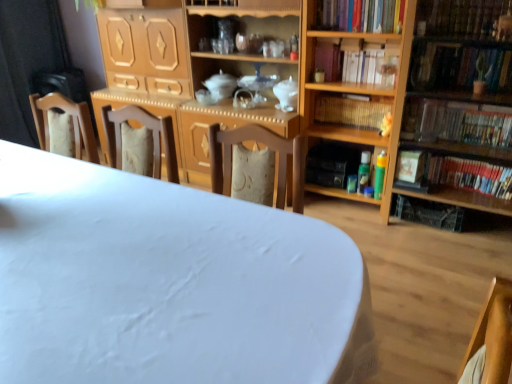
Question: Is wooden bookshelf at center, the fourth book from the top, not within wooden bookshelf at right, which is the 2th shelf from right to left?

Choices:
 (A) no
 (B) yes

Answer: (A)

Question: Does wooden bookshelf at center, positioned as the third book in bottom-to-top order, have a greater width compared to wooden bookshelf at right, which is the 2th shelf from right to left?

Choices:
 (A) no
 (B) yes

Answer: (A)

Question: Is wooden bookshelf at center, the fourth book from the top, smaller than wooden bookshelf at right, the first shelf viewed from the left?

Choices:
 (A) no
 (B) yes

Answer: (B)

Question: From the image's perspective, is wooden bookshelf at center, the fourth book from the top, on wooden bookshelf at right, the first shelf viewed from the left?

Choices:
 (A) yes
 (B) no

Answer: (A)

Question: Can you confirm if wooden bookshelf at center, positioned as the third book in bottom-to-top order, is taller than wooden bookshelf at right, the first shelf viewed from the left?

Choices:
 (A) yes
 (B) no

Answer: (B)

Question: From a real-world perspective, is wooden bookshelf at center, the fourth book from the top, beneath wooden bookshelf at right, which is the 2th shelf from right to left?

Choices:
 (A) no
 (B) yes

Answer: (B)

Question: From the image's perspective, is hardcover book at right, the second book ordered from the bottom, under wooden bookshelf at right, positioned as the 2th shelf in left-to-right order?

Choices:
 (A) no
 (B) yes

Answer: (B)

Question: From a real-world perspective, is hardcover book at right, the second book ordered from the bottom, positioned over wooden bookshelf at right, marked as the 1th shelf in a right-to-left arrangement, based on gravity?

Choices:
 (A) no
 (B) yes

Answer: (B)

Question: Is hardcover book at right, the second book ordered from the bottom, turned away from wooden bookshelf at right, positioned as the 2th shelf in left-to-right order?

Choices:
 (A) yes
 (B) no

Answer: (A)

Question: Can you confirm if hardcover book at right, which is counted as the fifth book, starting from the top, is taller than wooden bookshelf at right, positioned as the 2th shelf in left-to-right order?

Choices:
 (A) yes
 (B) no

Answer: (B)

Question: Is the position of hardcover book at right, the second book ordered from the bottom, more distant than that of wooden bookshelf at right, positioned as the 2th shelf in left-to-right order?

Choices:
 (A) no
 (B) yes

Answer: (B)

Question: Is hardcover book at right, the second book ordered from the bottom, positioned far away from wooden bookshelf at right, positioned as the 2th shelf in left-to-right order?

Choices:
 (A) yes
 (B) no

Answer: (B)

Question: Does hardcover book at right, the sixth book positioned from the top, have a larger size compared to white matte table at center?

Choices:
 (A) no
 (B) yes

Answer: (A)